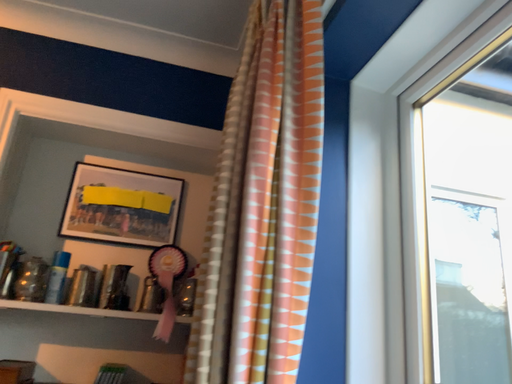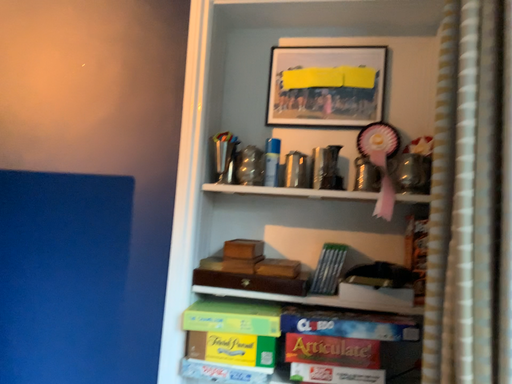
Question: How did the camera likely rotate when shooting the video?

Choices:
 (A) rotated right
 (B) rotated left

Answer: (B)